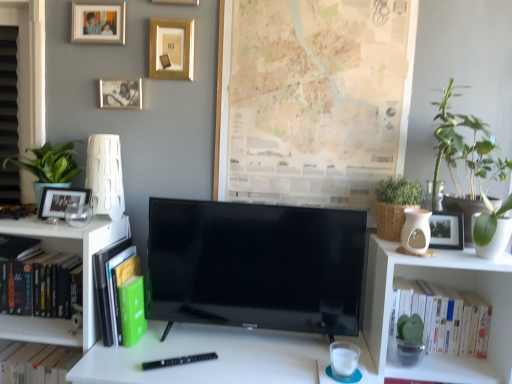
Question: Is green matte flowerpot at right wider than beige paper map at upper center?

Choices:
 (A) yes
 (B) no

Answer: (A)

Question: Is green matte flowerpot at right thinner than beige paper map at upper center?

Choices:
 (A) yes
 (B) no

Answer: (B)

Question: Is green matte flowerpot at right not near beige paper map at upper center?

Choices:
 (A) no
 (B) yes

Answer: (A)

Question: Does green matte flowerpot at right appear on the left side of beige paper map at upper center?

Choices:
 (A) yes
 (B) no

Answer: (B)

Question: From a real-world perspective, does green matte flowerpot at right sit lower than beige paper map at upper center?

Choices:
 (A) yes
 (B) no

Answer: (A)

Question: Considering the positions of point (29, 148) and point (44, 195), is point (29, 148) closer or farther from the camera than point (44, 195)?

Choices:
 (A) farther
 (B) closer

Answer: (A)

Question: From a real-world perspective, is green matte plant at left, which is counted as the 3th houseplant, starting from the right, positioned above or below matte black picture frame at left, marked as the 1th picture frame in a bottom-to-top arrangement?

Choices:
 (A) below
 (B) above

Answer: (B)

Question: Looking at the image, does green matte plant at left, positioned as the 1th houseplant in left-to-right order, seem bigger or smaller compared to matte black picture frame at left, arranged as the 5th picture frame when viewed from the top?

Choices:
 (A) small
 (B) big

Answer: (B)

Question: Do you think green matte plant at left, which is counted as the 3th houseplant, starting from the right, is within matte black picture frame at left, marked as the 1th picture frame in a bottom-to-top arrangement, or outside of it?

Choices:
 (A) outside
 (B) inside

Answer: (A)

Question: Is green matte flowerpot at right bigger or smaller than green matte book at left, placed as the 2th book when sorted from left to right?

Choices:
 (A) big
 (B) small

Answer: (B)

Question: In the image, is green matte flowerpot at right on the left side or the right side of green matte book at left, placed as the 2th book when sorted from left to right?

Choices:
 (A) left
 (B) right

Answer: (B)

Question: Considering their positions, is green matte flowerpot at right located in front of or behind green matte book at left, placed as the 2th book when sorted from left to right?

Choices:
 (A) front
 (B) behind

Answer: (A)

Question: In terms of width, does green matte flowerpot at right look wider or thinner when compared to green matte book at left, placed as the 2th book when sorted from left to right?

Choices:
 (A) thin
 (B) wide

Answer: (A)

Question: Would you say green leafy plant at upper right is to the left or to the right of white matte book at right, the third book positioned from the left, in the picture?

Choices:
 (A) right
 (B) left

Answer: (B)

Question: Is point (458, 140) closer or farther from the camera than point (413, 281)?

Choices:
 (A) closer
 (B) farther

Answer: (A)